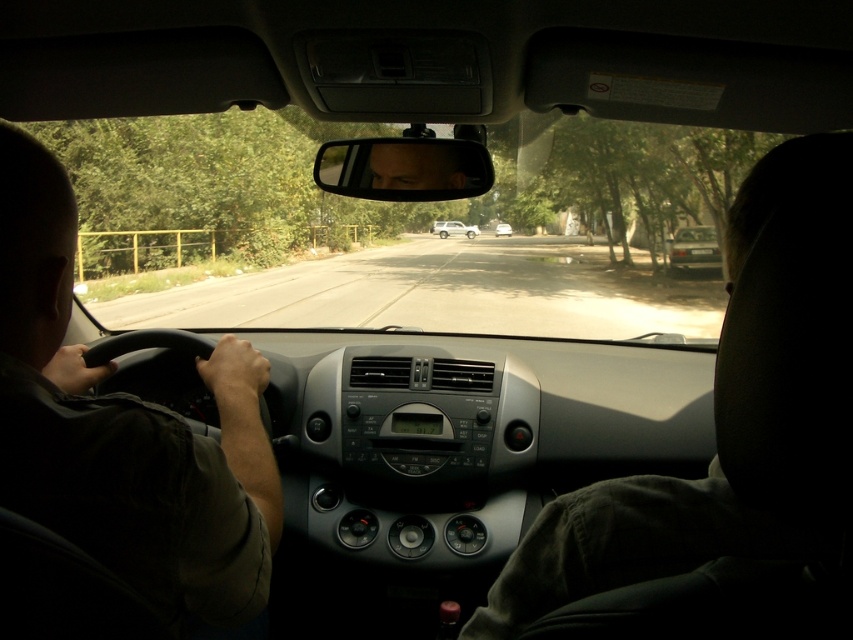
You are a passenger in the car and want to point out the white matte suv at center to the driver. Which side of the dark brown leather steering wheel at left should you direct their attention towards?

The white matte suv at center is to the right of the dark brown leather steering wheel at left, so you should direct the driver to look to the right side of the dark brown leather steering wheel at left.

You are a passenger in the car and want to know how far the point at coordinates (32,145) is from the camera. Can you determine the distance?

The point at coordinates (32,145) is 37.74 inches away from the camera.